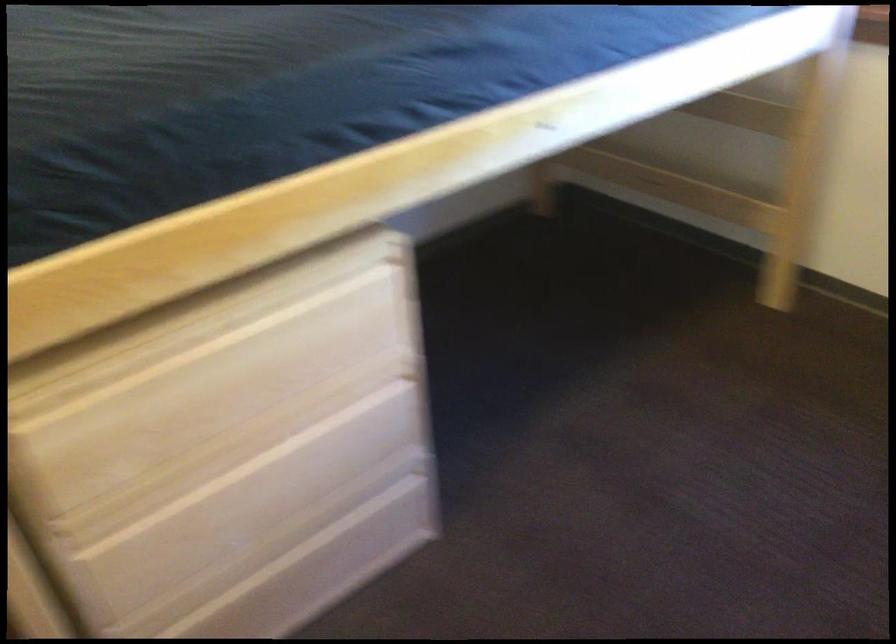
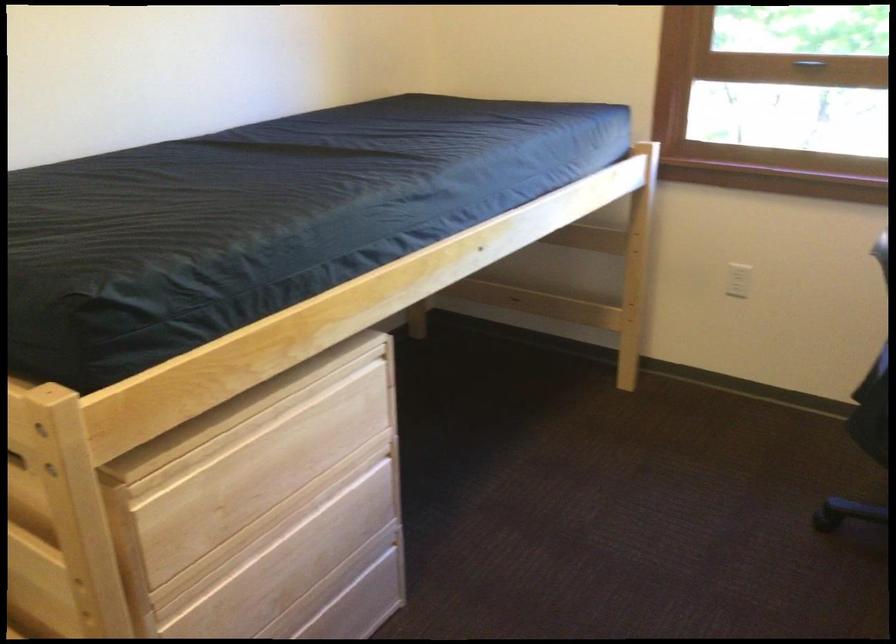
Locate, in the second image, the point that corresponds to [183,523] in the first image.

(230, 601)